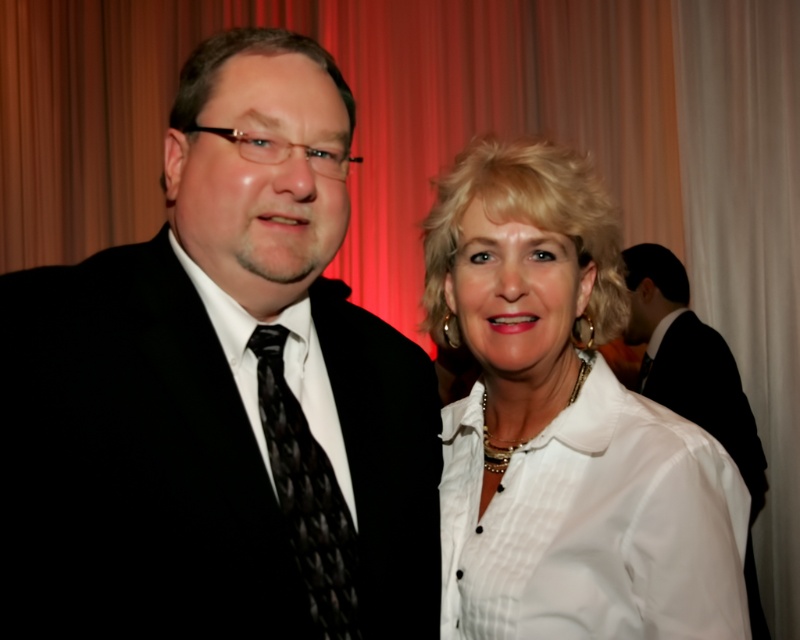
Question: Among these objects, which one is nearest to the camera?

Choices:
 (A) white satin blouse at center
 (B) black textured tie at left

Answer: (B)

Question: Does black satin suit at left have a greater width compared to black satin suit at right?

Choices:
 (A) yes
 (B) no

Answer: (B)

Question: Does black satin suit at left have a lesser width compared to black textured tie at left?

Choices:
 (A) no
 (B) yes

Answer: (A)

Question: Can you confirm if black satin suit at left is positioned above white satin blouse at center?

Choices:
 (A) no
 (B) yes

Answer: (B)

Question: Which point appears closest to the camera in this image?

Choices:
 (A) (750, 442)
 (B) (421, 552)

Answer: (B)

Question: Among these points, which one is farthest from the camera?

Choices:
 (A) (648, 260)
 (B) (320, 616)
 (C) (64, 292)

Answer: (A)